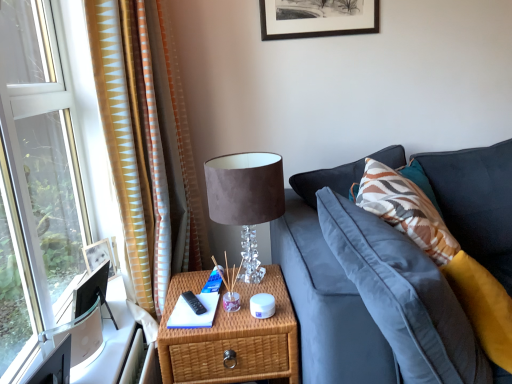
What are the coordinates of `free location above woven wood nightstand at center (from a real-world perspective)` in the screenshot? It's located at (203, 307).